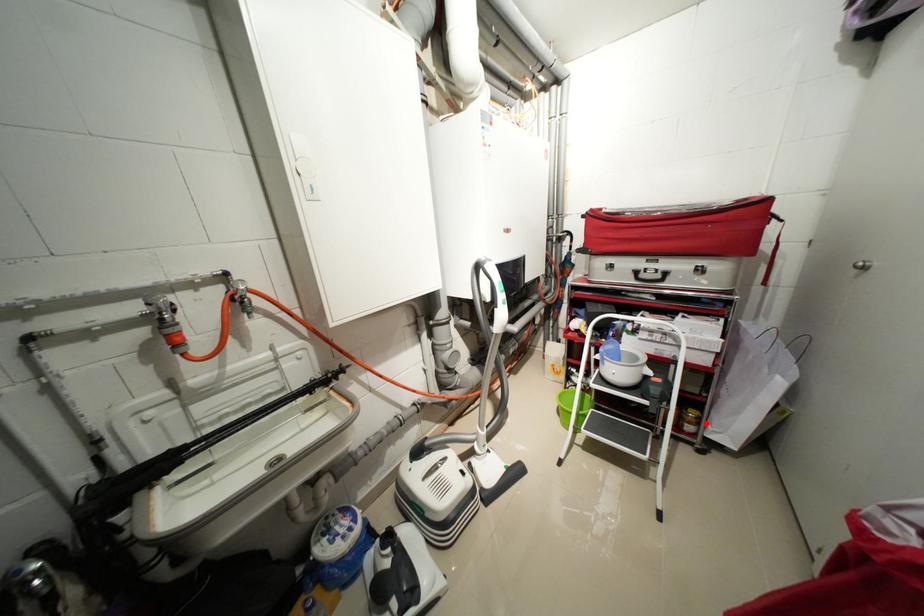
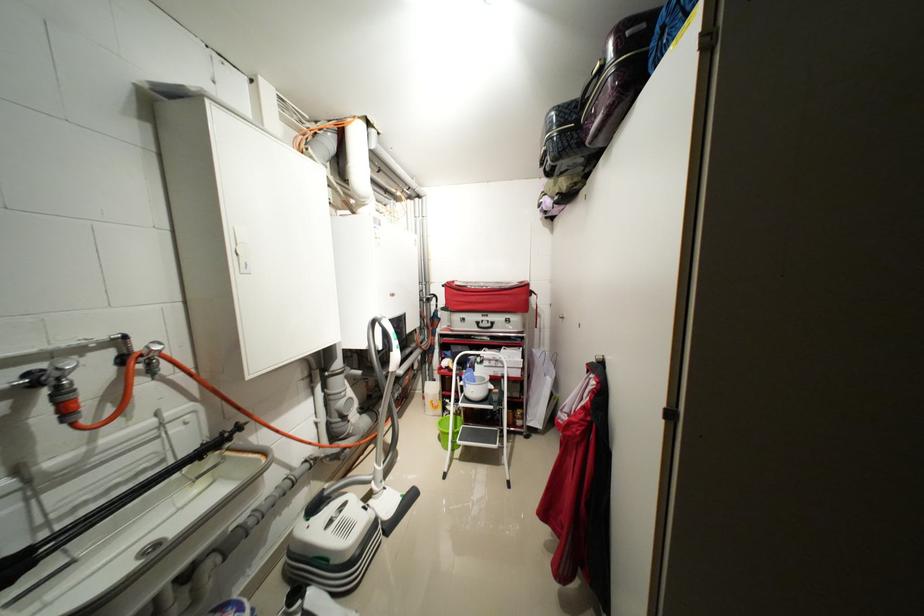
Question: I am providing you with two images of the same scene from different viewpoints. A red point is shown in image1. For the corresponding object point in image2, is it positioned nearer or farther from the camera?

Choices:
 (A) Nearer
 (B) Farther

Answer: (B)